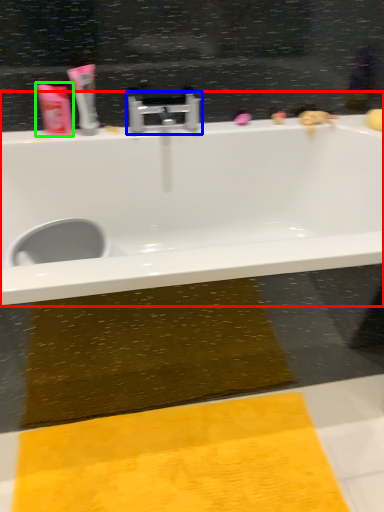
Question: Which is farther away from bathtub (highlighted by a red box)? tap (highlighted by a blue box) or toiletry (highlighted by a green box)?

Choices:
 (A) tap
 (B) toiletry

Answer: (B)